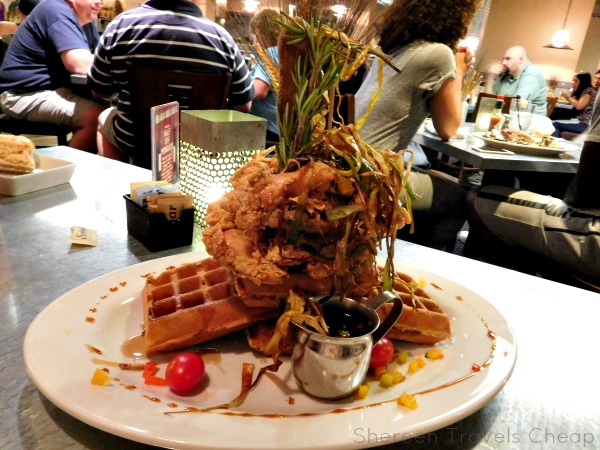
The image size is (600, 450). Identify the location of sugar container. (151, 226).